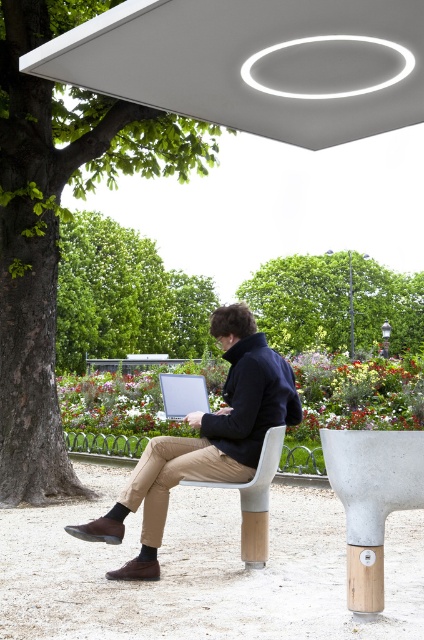
Question: Which point is farther to the camera?

Choices:
 (A) satin silver laptop at center
 (B) white matte canopy at upper center
 (C) green leafy tree at upper center

Answer: (C)

Question: In this image, where is matte black jacket at center located relative to concrete bench at center?

Choices:
 (A) left
 (B) right

Answer: (A)

Question: Can you confirm if white matte canopy at upper center is wider than green leafy tree at left?

Choices:
 (A) yes
 (B) no

Answer: (A)

Question: Which of the following is the closest to the observer?

Choices:
 (A) satin silver laptop at center
 (B) green leafy tree at left
 (C) concrete bench at center

Answer: (C)

Question: Does matte black jacket at center have a smaller size compared to green leafy tree at upper center?

Choices:
 (A) yes
 (B) no

Answer: (A)

Question: Which point is closer to the camera?

Choices:
 (A) green leafy tree at upper center
 (B) concrete bench at center
 (C) matte black jacket at center

Answer: (B)